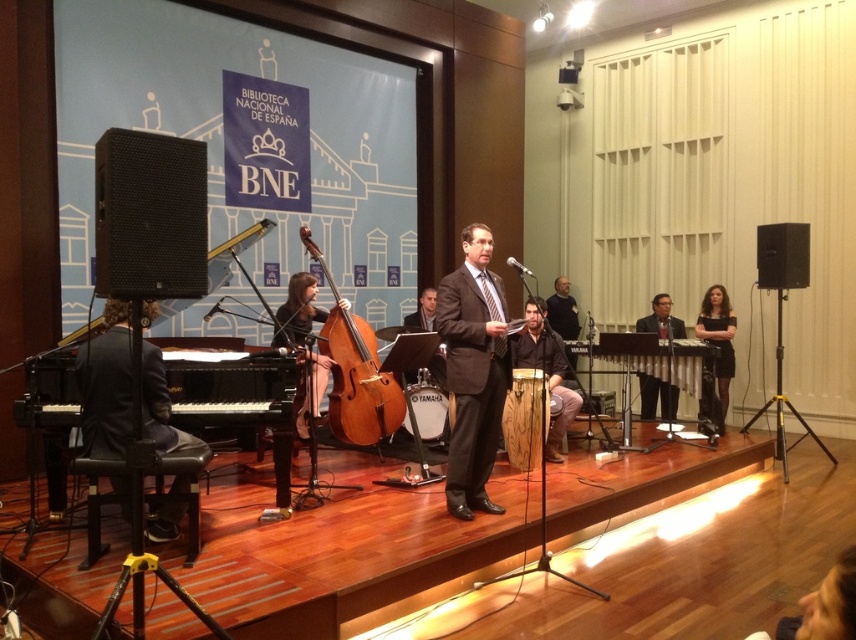
Question: Which of the following is the farthest from the observer?

Choices:
 (A) dark brown leather jacket at center
 (B) matte brown cello at center

Answer: (A)

Question: Can you confirm if black satin dress at right is smaller than matte black suit at center?

Choices:
 (A) yes
 (B) no

Answer: (B)

Question: Considering the real-world distances, which object is closest to the dark brown leather jacket at center?

Choices:
 (A) brown wooden cello at center
 (B) dark brown suit at center
 (C) matte brown wooden chair at center
 (D) wooden drum at center

Answer: (C)

Question: Which object is positioned closest to the dark gray suit at left?

Choices:
 (A) black satin dress at right
 (B) matte black suit at center
 (C) matte brown wooden chair at center
 (D) matte brown cello at center

Answer: (D)

Question: Does brown wooden cello at center have a larger size compared to wooden drum at center?

Choices:
 (A) yes
 (B) no

Answer: (A)

Question: In this image, where is matte brown cello at center located relative to black satin dress at right?

Choices:
 (A) above
 (B) below

Answer: (A)